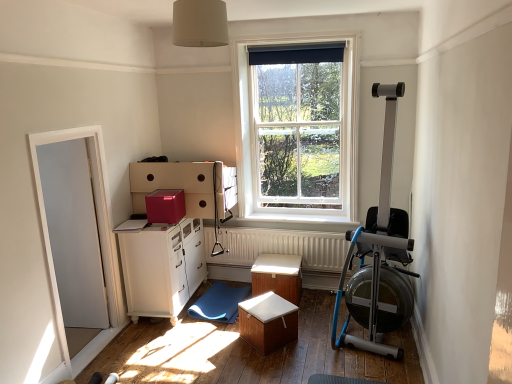
I want to click on vacant region in front of wooden table at center, which appears as the 2th table when viewed from the back, so click(269, 367).